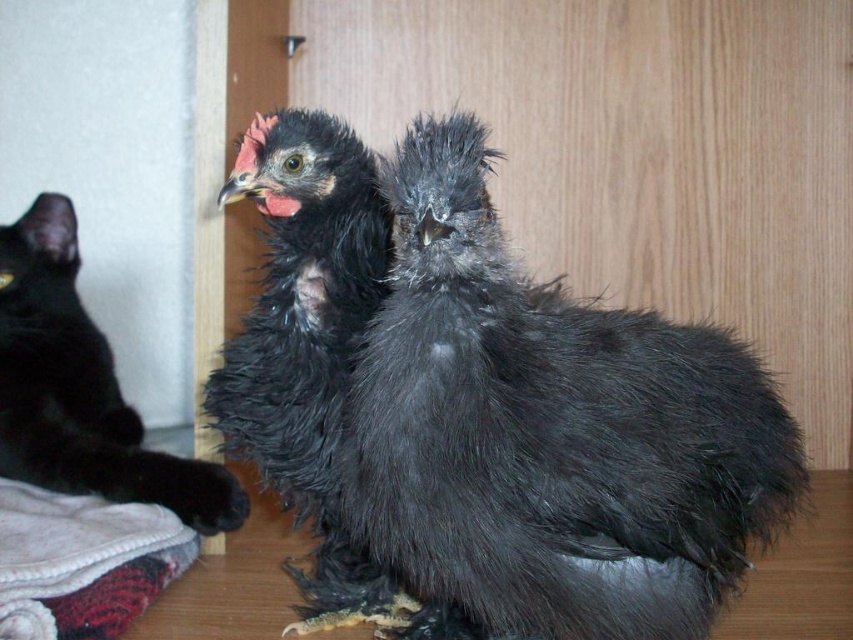
Which of these two, silky black chicken at center or black fluffy chicken at center, stands shorter?

silky black chicken at center

Is silky black chicken at center to the right of black fluffy chicken at center from the viewer's perspective?

Indeed, silky black chicken at center is positioned on the right side of black fluffy chicken at center.

What do you see at coordinates (549, 429) in the screenshot? I see `silky black chicken at center` at bounding box center [549, 429].

Where is `silky black chicken at center`? The image size is (853, 640). silky black chicken at center is located at coordinates (549, 429).

Is silky black chicken at center behind black fur cat at left?

No.

Based on the photo, who is more distant from viewer, [589,472] or [10,273]?

The point [10,273] is behind.

This screenshot has width=853, height=640. What do you see at coordinates (549, 429) in the screenshot?
I see `silky black chicken at center` at bounding box center [549, 429].

At what (x,y) coordinates should I click in order to perform the action: click on silky black chicken at center. Please return your answer as a coordinate pair (x, y). Looking at the image, I should click on (549, 429).

Between point (334, 406) and point (16, 300), which one is positioned behind?

Point (16, 300)

Who is taller, black fluffy chicken at center or black fur cat at left?

With more height is black fluffy chicken at center.

Locate an element on the screen. The image size is (853, 640). black fluffy chicken at center is located at coordinates (308, 346).